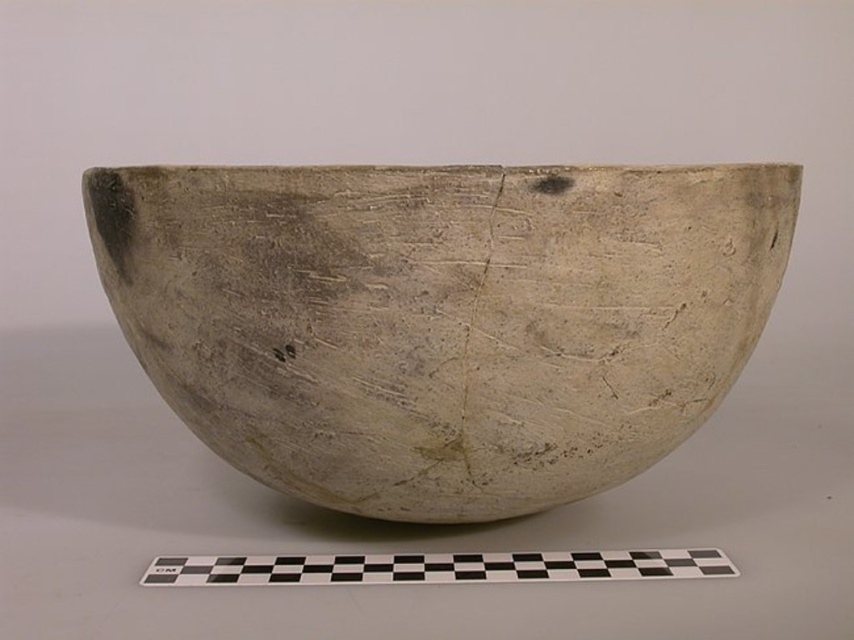
Where is the matte clay bowl at center located in the image?

The matte clay bowl at center is located at point (442,320).

You are an archaeologist examining the ancient ceramic bowl. You notice two points on the bowl marked as point 1 at coordinate (313, 376) and point 2 at coordinate (457, 561). Which point is closer to you?

Point 1 at coordinate (313, 376) is closer to you than point 2 at coordinate (457, 561).